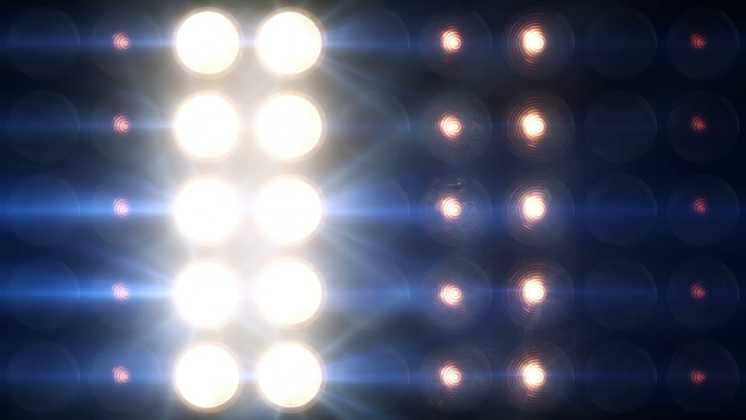
I want to click on "on" spotlights, so click(218, 34), click(306, 50), click(277, 130), click(201, 216), click(283, 224), click(225, 137), click(207, 284), click(295, 299), click(289, 386), click(195, 383).